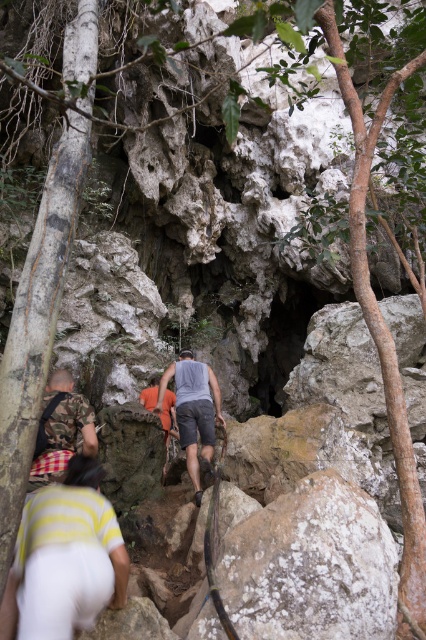
Question: Does yellow striped shirt at lower left appear on the left side of gray cotton tank top at center?

Choices:
 (A) yes
 (B) no

Answer: (A)

Question: Which of the following is the closest to the observer?

Choices:
 (A) (45, 394)
 (B) (186, 416)

Answer: (A)

Question: Observing the image, what is the correct spatial positioning of gray cotton tank top at center in reference to camo fabric shirt at lower left?

Choices:
 (A) left
 (B) right

Answer: (B)

Question: Among these objects, which one is nearest to the camera?

Choices:
 (A) yellow striped shirt at lower left
 (B) camo fabric shirt at lower left

Answer: (A)

Question: Can you confirm if yellow striped shirt at lower left is thinner than gray cotton tank top at center?

Choices:
 (A) no
 (B) yes

Answer: (B)

Question: Estimate the real-world distances between objects in this image. Which object is closer to the camo fabric shirt at lower left?

Choices:
 (A) yellow striped shirt at lower left
 (B) gray cotton tank top at center

Answer: (A)